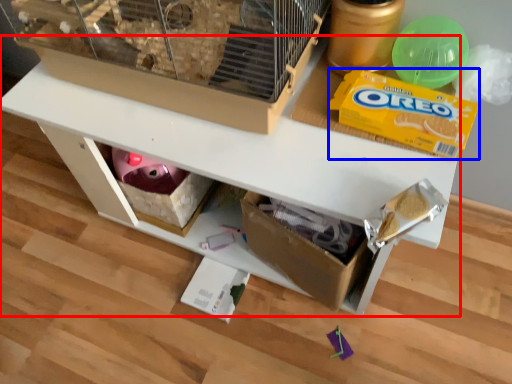
Question: Among these objects, which one is nearest to the camera, table (highlighted by a red box) or cereal (highlighted by a blue box)?

Choices:
 (A) table
 (B) cereal

Answer: (A)